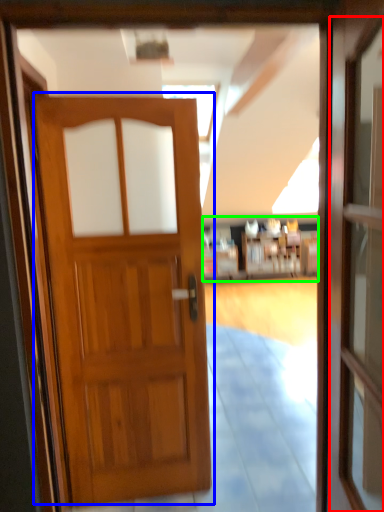
Question: Which object is the closest to the screen door (highlighted by a red box)? Choose among these: door (highlighted by a blue box) or hotel lobby (highlighted by a green box).

Choices:
 (A) door
 (B) hotel lobby

Answer: (A)